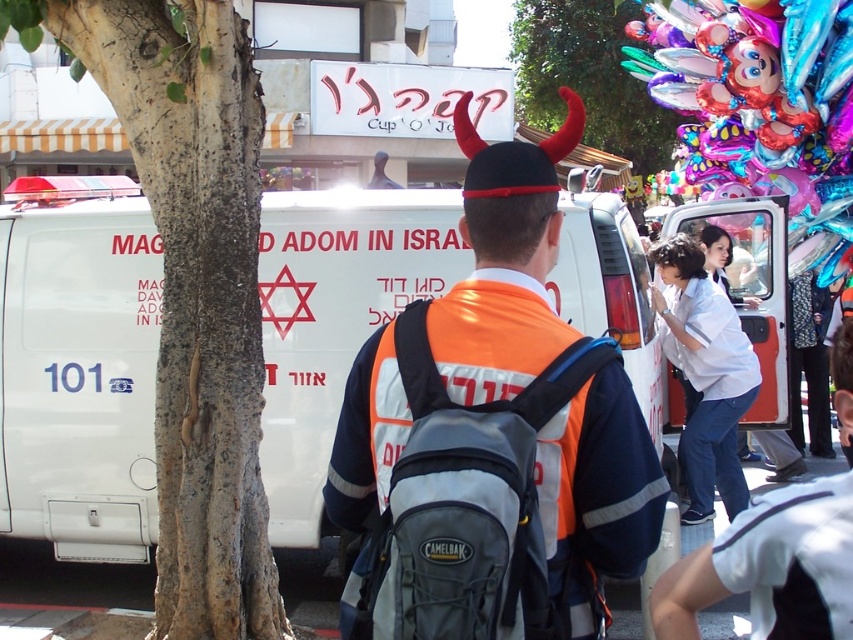
Does white van at center have a greater width compared to shiny metallic clown at upper right?

In fact, white van at center might be narrower than shiny metallic clown at upper right.

Describe the element at coordinates (78, 369) in the screenshot. This screenshot has width=853, height=640. I see `white van at center` at that location.

Is point (136, 232) farther from camera compared to point (793, 141)?

No.

Find the location of a particular element. This screenshot has width=853, height=640. white van at center is located at coordinates point(78,369).

Does point (590, 269) lie in front of point (534, 109)?

Yes, it is in front of point (534, 109).

Does white van at center appear under green leafy tree at upper center?

Indeed, white van at center is positioned under green leafy tree at upper center.

In order to click on white van at center in this screenshot , I will do `click(78, 369)`.

Does green leafy tree at upper center have a lesser height compared to white cotton shirt at right?

No, green leafy tree at upper center is not shorter than white cotton shirt at right.

Is green leafy tree at upper center below white cotton shirt at right?

No.

Between point (515, 8) and point (688, 300), which one is positioned behind?

Point (515, 8)

Locate an element on the screen. green leafy tree at upper center is located at coordinates (589, 77).